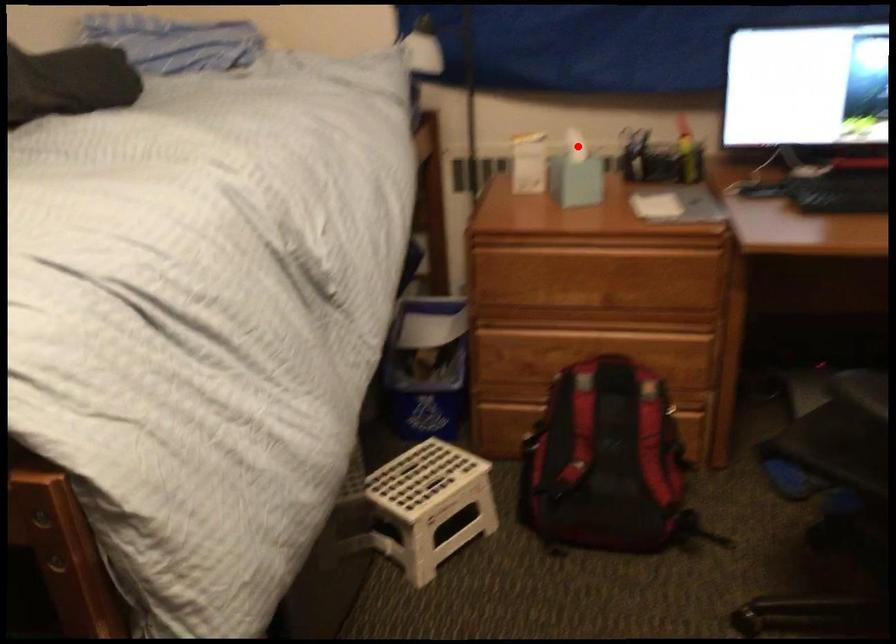
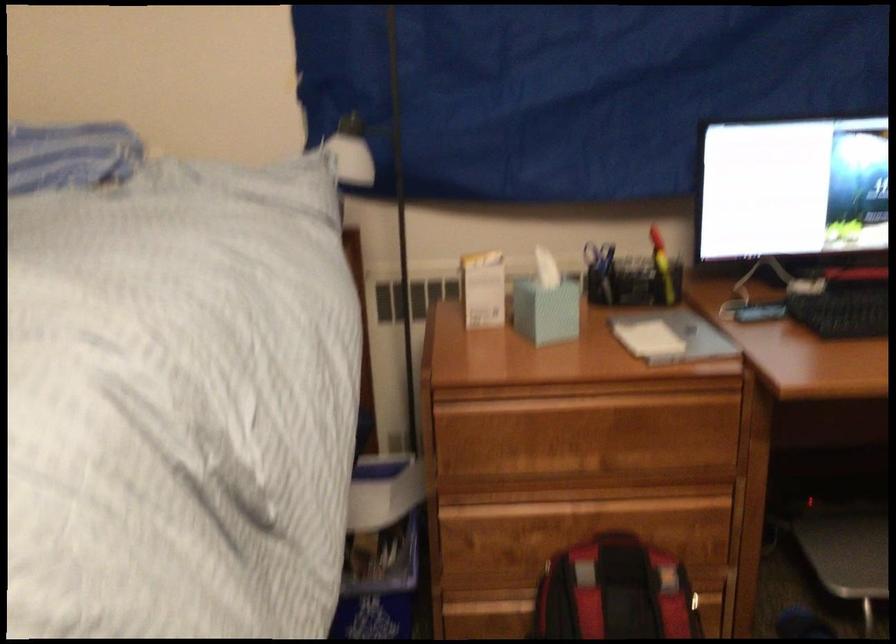
Where in the second image is the point corresponding to the highlighted location from the first image?

(545, 270)